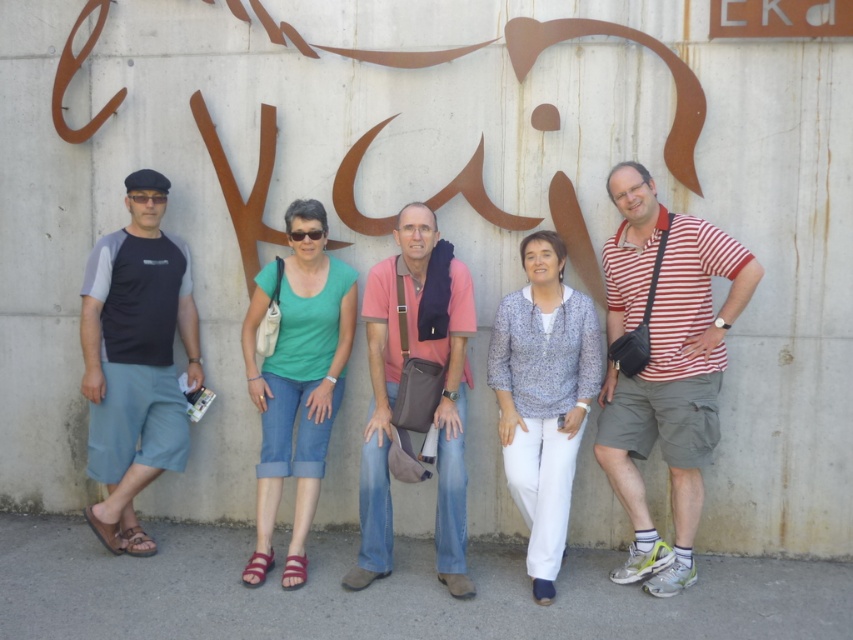
You are standing in front of the EKO wall and need to locate the striped cotton shirt at center. According to the coordinates provided, where exactly would you look to find it?

The striped cotton shirt at center is located at the 2D coordinates point (672, 397).

You are standing in front of the EKO wall and want to find the pink fabric shirt at center. According to the coordinates given, where would you look relative to the other people in the group?

The pink fabric shirt at center is located at coordinates point (397,392), which places it at the center of the image. Since it is at the center, it is positioned between the individuals in the group.